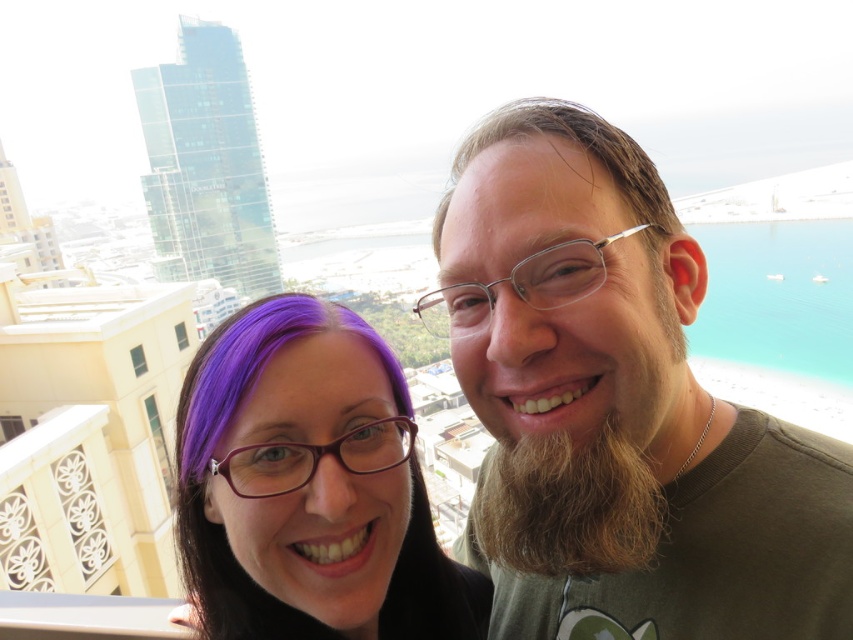
You are a photographer trying to capture a clear shot of the two people in the scene. You need to focus on the brown matte shirt at right and the brown matte hair at upper center. Which object is located lower in the frame?

The brown matte shirt at right is positioned under brown matte hair at upper center, so the shirt is lower than the hair in the frame.

You are a photographer trying to capture a clear shot of both the brown matte shirt at right and the brown matte hair at upper center. Since the shirt is larger, which object will appear more prominent in the photo?

The brown matte shirt at right will appear more prominent in the photo because it is larger in size than the brown matte hair at upper center.

You are a photographer trying to focus on the person with purple hair and glasses. You notice a point at coordinates (567, 506) in the image. Where is this point located?

The point at coordinates (567, 506) is located on the brown fuzzy beard at right.